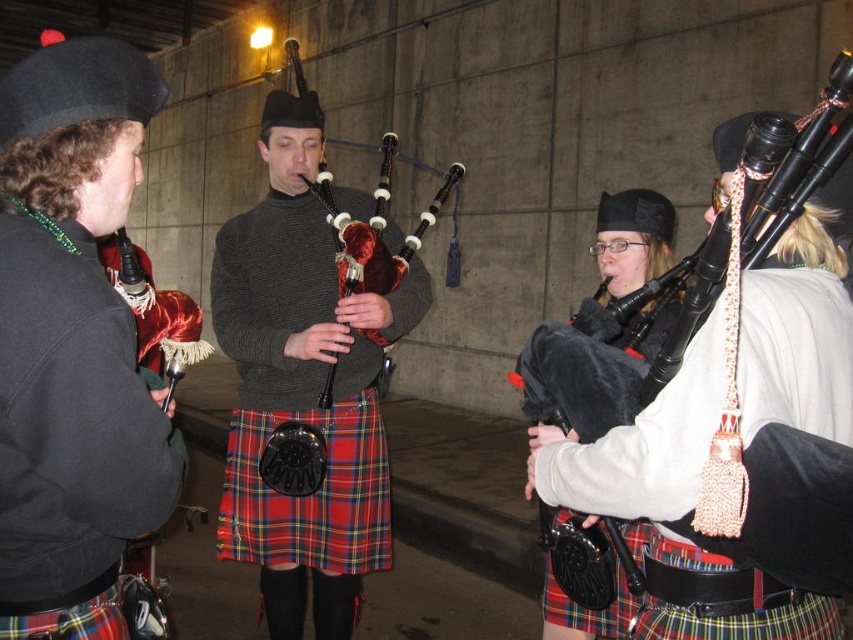
Does black velvet bagpipes at center have a smaller size compared to matte black bagpipe at center?

No.

Does black velvet bagpipes at center appear under matte black bagpipe at center?

Yes, black velvet bagpipes at center is below matte black bagpipe at center.

Between point (837, 346) and point (544, 620), which one is positioned in front?

Positioned in front is point (837, 346).

Identify the location of black velvet bagpipes at center. (643, 456).

Does velvet red bagpipes at center have a smaller size compared to tartan fabric kilt at center?

No.

Is velvet red bagpipes at center wider than tartan fabric kilt at center?

Yes, velvet red bagpipes at center is wider than tartan fabric kilt at center.

Does point (350, 356) come farther from viewer compared to point (384, 436)?

No.

Locate an element on the screen. Image resolution: width=853 pixels, height=640 pixels. velvet red bagpipes at center is located at coordinates (303, 387).

Is matte black bagpipe at center further to the viewer compared to velvet bagpipe at center?

No, matte black bagpipe at center is closer to the viewer.

Who is lower down, matte black bagpipe at center or velvet bagpipe at center?

matte black bagpipe at center

Who is more forward, (x=556, y=620) or (x=387, y=253)?

Point (x=556, y=620) is in front.

The width and height of the screenshot is (853, 640). I want to click on matte black bagpipe at center, so click(x=631, y=240).